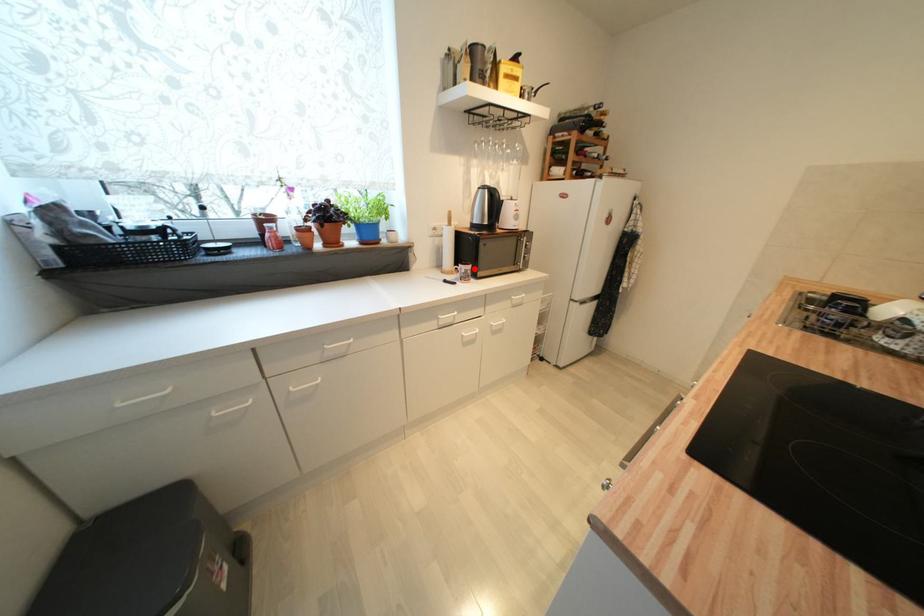
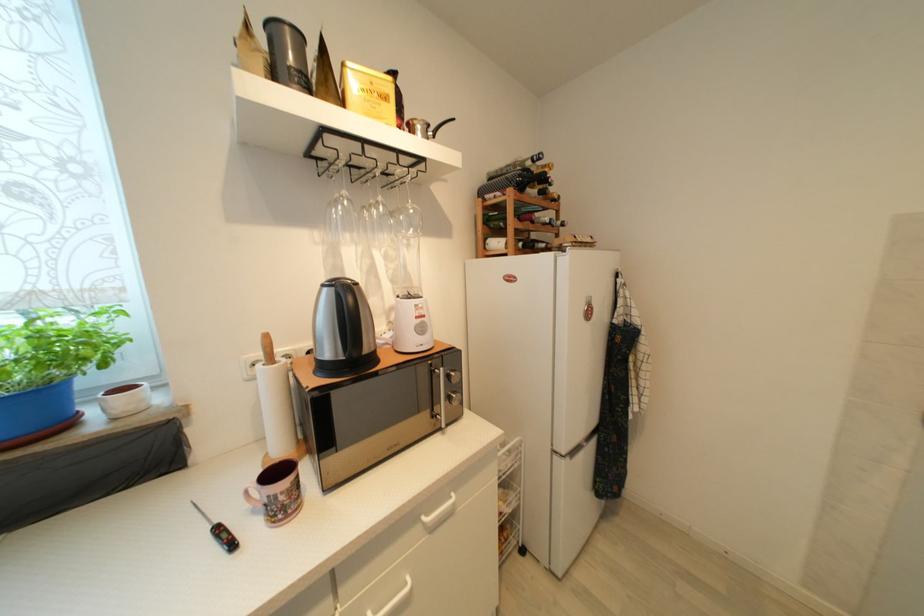
Where in the second image is the point corresponding to the highlighted location from the first image?

(289, 485)